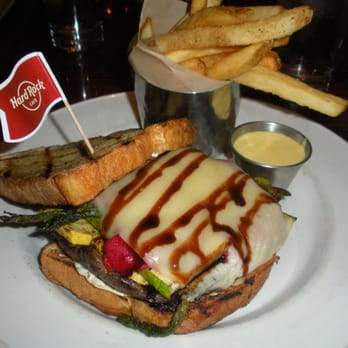
This screenshot has height=348, width=348. What are the coordinates of `silver cup` in the screenshot? It's located at pyautogui.click(x=208, y=112).